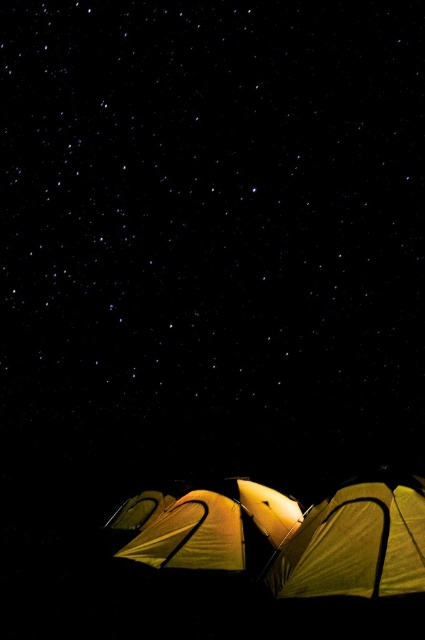
Which is in front, point (421, 500) or point (178, 557)?

Point (421, 500) is in front.

Who is shorter, yellow fabric tent at lower right or matte yellow tent at lower center?

Standing shorter between the two is matte yellow tent at lower center.

This screenshot has width=425, height=640. What do you see at coordinates (357, 541) in the screenshot?
I see `yellow fabric tent at lower right` at bounding box center [357, 541].

Where is `yellow fabric tent at lower right`? The width and height of the screenshot is (425, 640). yellow fabric tent at lower right is located at coordinates (357, 541).

You are a GUI agent. You are given a task and a screenshot of the screen. Output one action in this format:
    pyautogui.click(x=<x>, y=<y>)
    Task: Click on the yellow fabric tent at lower center
    
    Given the screenshot: What is the action you would take?
    pyautogui.click(x=291, y=536)

Can you confirm if yellow fabric tent at lower center is positioned below matte yellow tent at lower center?

Yes, yellow fabric tent at lower center is below matte yellow tent at lower center.

Who is more distant from viewer, (124, 548) or (229, 483)?

The point (229, 483) is behind.

Image resolution: width=425 pixels, height=640 pixels. Identify the location of yellow fabric tent at lower center. (291, 536).

In the scene shown: Can you confirm if yellow fabric tent at lower center is positioned below yellow fabric tent at lower right?

Indeed, yellow fabric tent at lower center is positioned under yellow fabric tent at lower right.

How far apart are yellow fabric tent at lower center and yellow fabric tent at lower right?

A distance of 5.80 feet exists between yellow fabric tent at lower center and yellow fabric tent at lower right.

Identify the location of yellow fabric tent at lower center. coord(291,536).

This screenshot has height=640, width=425. Identify the location of yellow fabric tent at lower center. (291, 536).